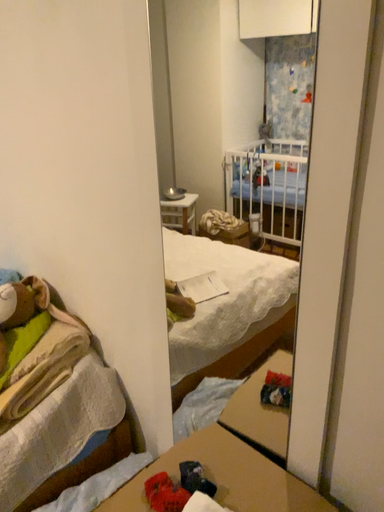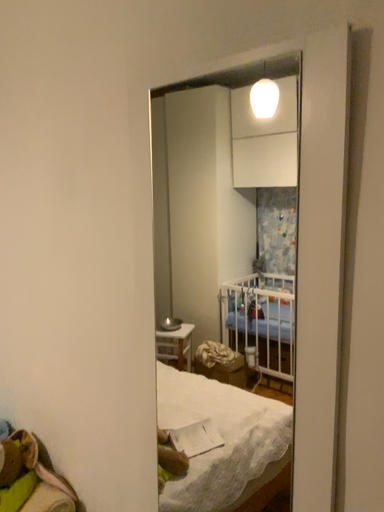
Question: How did the camera likely rotate when shooting the video?

Choices:
 (A) rotated downward
 (B) rotated upward

Answer: (B)